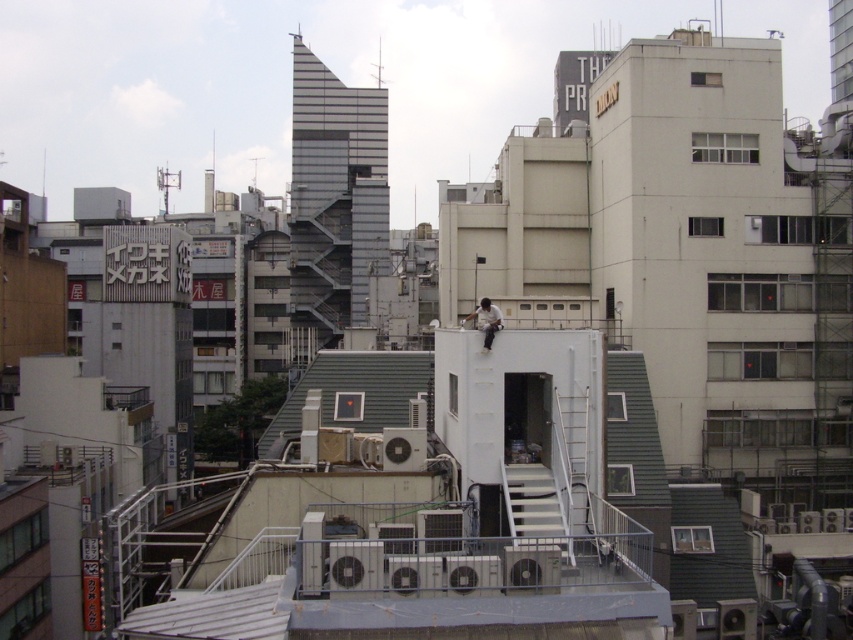
Can you confirm if green matte roof at center is positioned to the right of white matte shirt at center?

In fact, green matte roof at center is to the left of white matte shirt at center.

The width and height of the screenshot is (853, 640). Identify the location of green matte roof at center. coord(352,394).

Find the location of a particular element. The image size is (853, 640). green matte roof at center is located at coordinates (352, 394).

Identify the location of green matte roof at center. Image resolution: width=853 pixels, height=640 pixels. (352, 394).